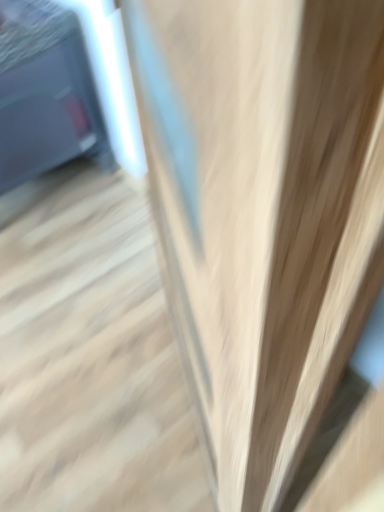
Question: Is light wood stairs at center outside of matte black tv at left?

Choices:
 (A) yes
 (B) no

Answer: (A)

Question: Is light wood stairs at center in contact with matte black tv at left?

Choices:
 (A) no
 (B) yes

Answer: (A)

Question: Is light wood stairs at center to the left of matte black tv at left from the viewer's perspective?

Choices:
 (A) no
 (B) yes

Answer: (A)

Question: Is light wood stairs at center positioned with its back to matte black tv at left?

Choices:
 (A) no
 (B) yes

Answer: (A)

Question: Does light wood stairs at center have a smaller size compared to matte black tv at left?

Choices:
 (A) no
 (B) yes

Answer: (B)

Question: Is light wood stairs at center wider than matte black tv at left?

Choices:
 (A) yes
 (B) no

Answer: (A)

Question: Is the depth of matte black tv at left less than that of light wood stairs at center?

Choices:
 (A) yes
 (B) no

Answer: (B)

Question: Is matte black tv at left shorter than light wood stairs at center?

Choices:
 (A) no
 (B) yes

Answer: (A)

Question: Is matte black tv at left beside light wood stairs at center?

Choices:
 (A) yes
 (B) no

Answer: (B)

Question: Is matte black tv at left far from light wood stairs at center?

Choices:
 (A) no
 (B) yes

Answer: (A)

Question: Would you say light wood stairs at center is part of matte black tv at left's contents?

Choices:
 (A) yes
 (B) no

Answer: (B)

Question: Does matte black tv at left have a greater height compared to light wood stairs at center?

Choices:
 (A) no
 (B) yes

Answer: (B)

Question: From their relative heights in the image, would you say matte black tv at left is taller or shorter than light wood stairs at center?

Choices:
 (A) short
 (B) tall

Answer: (B)